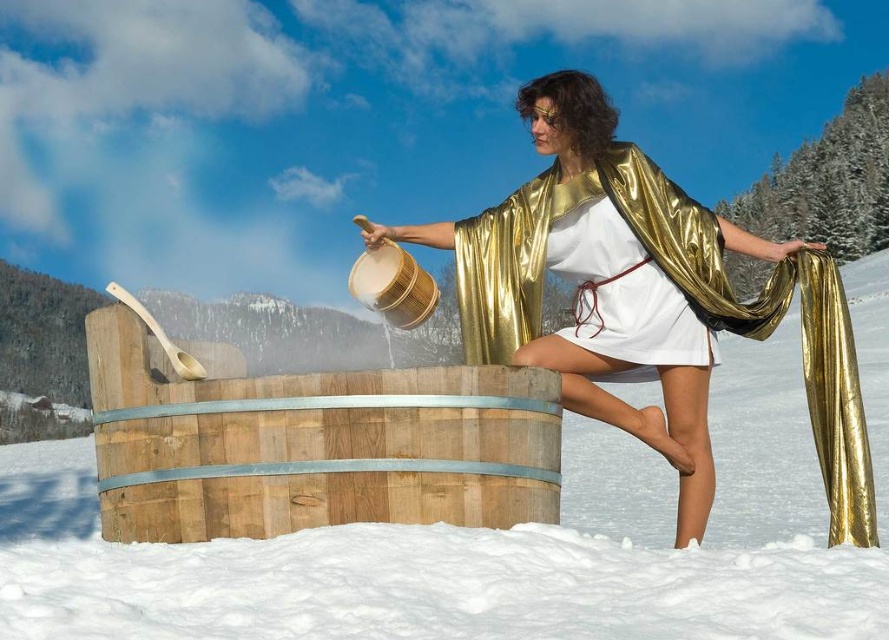
You are an observer standing in the snowy landscape. You notice the white fluffy snow at center and the metallic gold robe at center. Which object is taller from your viewpoint?

The white fluffy snow at center is much taller than the metallic gold robe at center.

You are a photographer trying to capture the scene where the person is pouring water into the barrel. Based on the positions of the white fluffy snow at center and the metallic gold robe at center, where should you position your camera to ensure both elements are visible in the frame?

Position your camera above the white fluffy snow at center since it is below the metallic gold robe at center, allowing both elements to be captured in the frame.